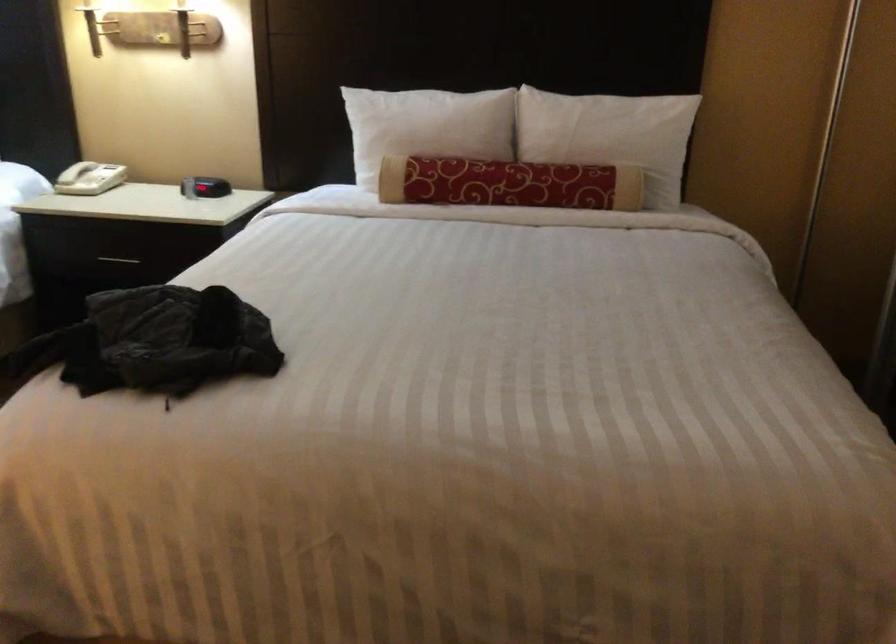
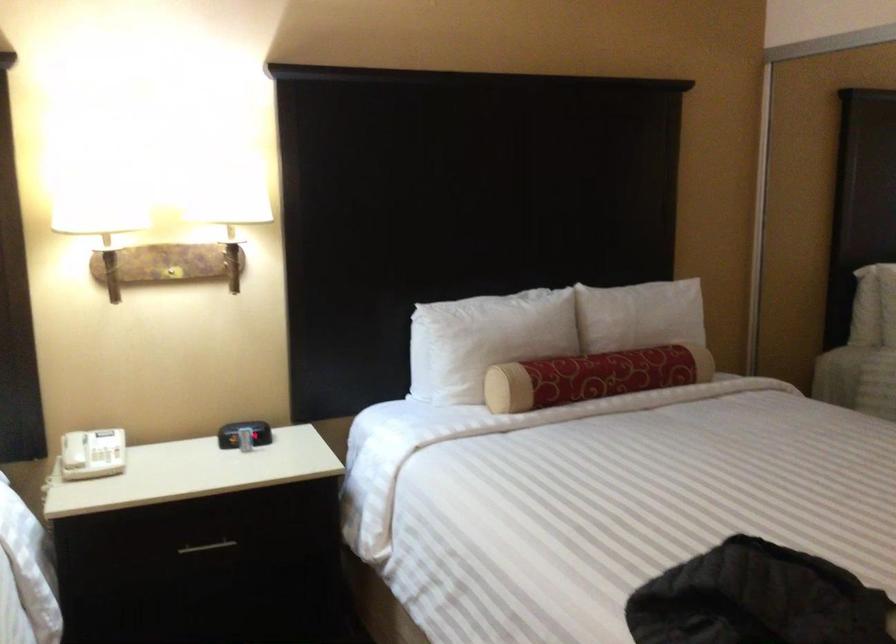
Where in the second image is the point corresponding to [578,134] from the first image?

(643, 319)